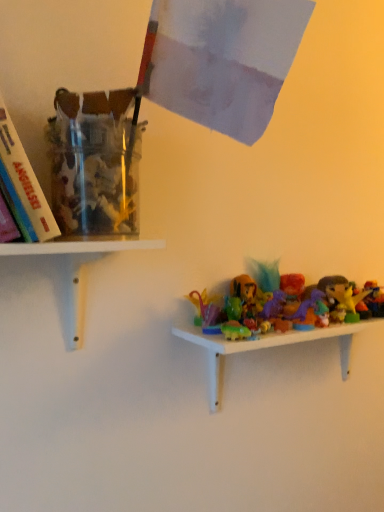
Question: Should I look upward or downward to see white matte shelf at lower left, which is the 1th shelf from left to right?

Choices:
 (A) up
 (B) down

Answer: (B)

Question: From the image's perspective, is white matte shelf at lower left, marked as the second shelf in a bottom-to-top arrangement, beneath plastic toy figures at lower right, the second shelf in the left-to-right sequence?

Choices:
 (A) no
 (B) yes

Answer: (A)

Question: Is the depth of white matte shelf at lower left, acting as the second shelf starting from the right, greater than that of plastic toy figures at lower right, marked as the 2th shelf in a top-to-bottom arrangement?

Choices:
 (A) no
 (B) yes

Answer: (A)

Question: Does white matte shelf at lower left, acting as the second shelf starting from the right, have a lesser width compared to plastic toy figures at lower right, placed as the 1th shelf when sorted from bottom to top?

Choices:
 (A) yes
 (B) no

Answer: (B)

Question: From a real-world perspective, does white matte shelf at lower left, which is the 1th shelf from left to right, sit lower than plastic toy figures at lower right, marked as the 2th shelf in a top-to-bottom arrangement?

Choices:
 (A) no
 (B) yes

Answer: (A)

Question: Is white matte shelf at lower left, positioned as the first shelf in top-to-bottom order, outside plastic toy figures at lower right, marked as the 2th shelf in a top-to-bottom arrangement?

Choices:
 (A) no
 (B) yes

Answer: (B)

Question: Considering the relative sizes of white matte shelf at lower left, positioned as the first shelf in top-to-bottom order, and plastic toy figures at lower right, which is the first shelf from right to left, in the image provided, is white matte shelf at lower left, positioned as the first shelf in top-to-bottom order, shorter than plastic toy figures at lower right, which is the first shelf from right to left,?

Choices:
 (A) no
 (B) yes

Answer: (B)

Question: Considering the relative positions of plastic toy figures at lower right, which is the first shelf from right to left, and white matte shelf at lower left, acting as the second shelf starting from the right, in the image provided, is plastic toy figures at lower right, which is the first shelf from right to left, to the left of white matte shelf at lower left, acting as the second shelf starting from the right, from the viewer's perspective?

Choices:
 (A) yes
 (B) no

Answer: (B)

Question: Is plastic toy figures at lower right, the second shelf in the left-to-right sequence, outside white matte shelf at lower left, marked as the second shelf in a bottom-to-top arrangement?

Choices:
 (A) no
 (B) yes

Answer: (B)

Question: From the image's perspective, is plastic toy figures at lower right, which is the first shelf from right to left, below white matte shelf at lower left, marked as the second shelf in a bottom-to-top arrangement?

Choices:
 (A) yes
 (B) no

Answer: (A)

Question: From the image's perspective, does plastic toy figures at lower right, placed as the 1th shelf when sorted from bottom to top, appear higher than white matte shelf at lower left, marked as the second shelf in a bottom-to-top arrangement?

Choices:
 (A) yes
 (B) no

Answer: (B)

Question: Is plastic toy figures at lower right, which is the first shelf from right to left, wider than white matte shelf at lower left, positioned as the first shelf in top-to-bottom order?

Choices:
 (A) yes
 (B) no

Answer: (B)

Question: From a real-world perspective, does plastic toy figures at lower right, placed as the 1th shelf when sorted from bottom to top, stand above white matte shelf at lower left, marked as the second shelf in a bottom-to-top arrangement?

Choices:
 (A) yes
 (B) no

Answer: (B)

Question: Is plastic toy figures at lower right, placed as the 1th shelf when sorted from bottom to top, taller or shorter than white matte shelf at lower left, positioned as the first shelf in top-to-bottom order?

Choices:
 (A) tall
 (B) short

Answer: (A)